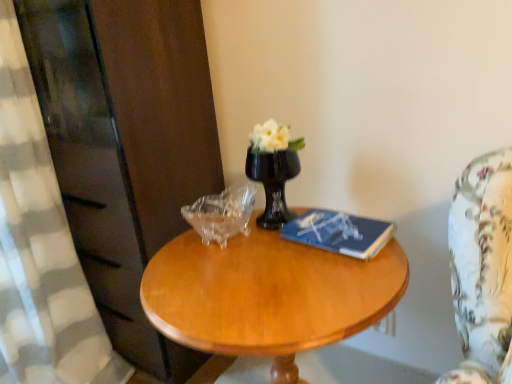
Find the location of `empty space that is in between blue matte book at center and transparent glass piggy bank at center`. empty space that is in between blue matte book at center and transparent glass piggy bank at center is located at coordinates coord(269,247).